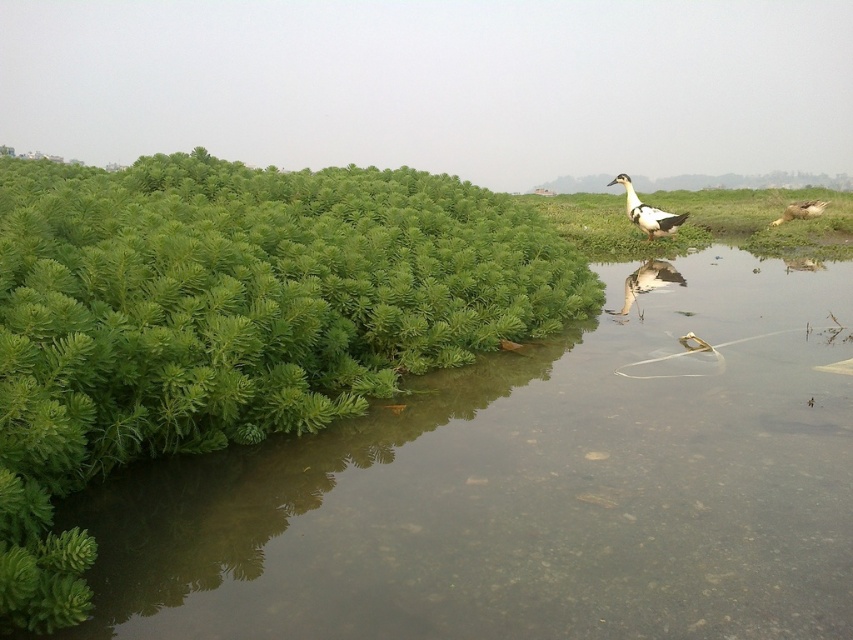
Can you confirm if green leafy vegetation at lower left is shorter than brown speckled feathers at right?

In fact, green leafy vegetation at lower left may be taller than brown speckled feathers at right.

Who is more forward, (x=210, y=500) or (x=791, y=212)?

Point (x=210, y=500) is in front.

I want to click on green leafy vegetation at lower left, so click(x=531, y=490).

Does point (642, 460) lie behind point (648, 268)?

No.

Identify the location of green leafy vegetation at lower left. pyautogui.click(x=531, y=490).

Does point (508, 636) come in front of point (648, 275)?

That is True.

I want to click on green leafy vegetation at lower left, so click(x=531, y=490).

Consider the image. Between white glossy duck at center-right and white-feathered duck at upper right, which one is positioned higher?

white-feathered duck at upper right is higher up.

You are a GUI agent. You are given a task and a screenshot of the screen. Output one action in this format:
    pyautogui.click(x=<x>, y=<y>)
    Task: Click on the white glossy duck at center-right
    This screenshot has width=853, height=640.
    Given the screenshot: What is the action you would take?
    pyautogui.click(x=647, y=282)